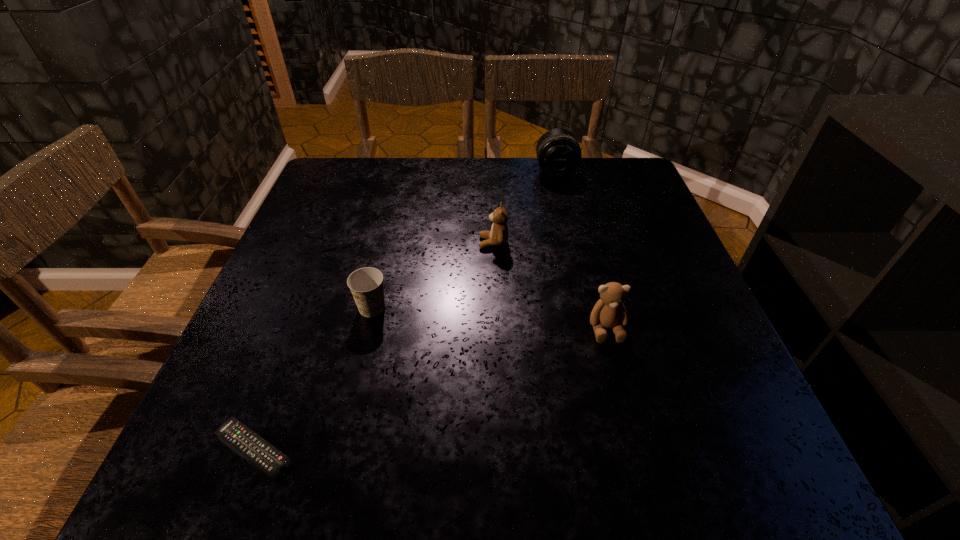
Locate an element on the screen. The width and height of the screenshot is (960, 540). unoccupied area between the fourth object from right to left and the left teddy bear is located at coordinates (433, 275).

Where is `free point between the telephoto lens and the nearest object`? The width and height of the screenshot is (960, 540). free point between the telephoto lens and the nearest object is located at coordinates (404, 309).

You are a GUI agent. You are given a task and a screenshot of the screen. Output one action in this format:
    pyautogui.click(x=<x>, y=<y>)
    Task: Click on the vacant space that's between the fourth nearest object and the remote control
    Image resolution: width=960 pixels, height=540 pixels.
    Given the screenshot: What is the action you would take?
    pyautogui.click(x=373, y=346)

Find the location of `vacant area between the fourth nearest object and the leftmost object`. vacant area between the fourth nearest object and the leftmost object is located at coordinates (373, 346).

This screenshot has width=960, height=540. What are the coordinates of `free space between the farthest object and the leftmost object` in the screenshot? It's located at (404, 309).

The height and width of the screenshot is (540, 960). In order to click on object that stands as the third closest to the farther teddy bear in this screenshot , I will do `click(558, 152)`.

Select which object is the closest to the telephoto lens. Please provide its 2D coordinates. Your answer should be formatted as a tuple, i.e. [(x, y)], where the tuple contains the x and y coordinates of a point satisfying the conditions above.

[(498, 236)]

The height and width of the screenshot is (540, 960). Find the location of `vacant area in the image that satisfies the following two spatial constraints: 1. on the front-facing side of the fourth nearest object; 2. on the front side of the leftmost object`. vacant area in the image that satisfies the following two spatial constraints: 1. on the front-facing side of the fourth nearest object; 2. on the front side of the leftmost object is located at coordinates (500, 449).